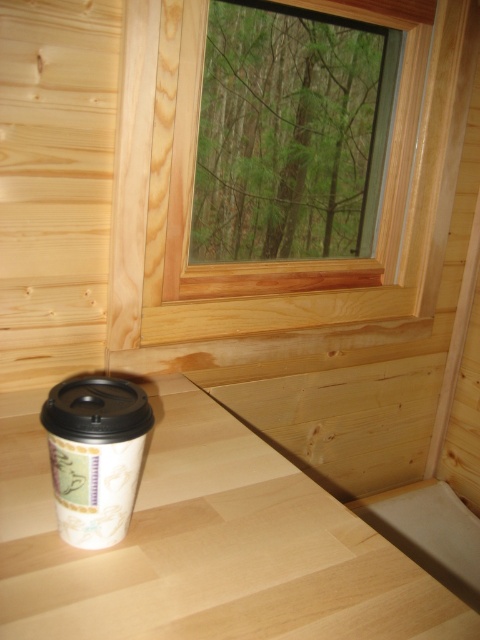
Does point (109, 563) come closer to viewer compared to point (352, 305)?

Yes.

Locate an element on the screen. This screenshot has width=480, height=640. white wood table at lower center is located at coordinates (204, 544).

Find the location of a particular element. white wood table at lower center is located at coordinates (204, 544).

Is natural wood window at upper center closer to the viewer compared to white paper cup at lower left?

That is False.

Consider the image. Who is shorter, natural wood window at upper center or white paper cup at lower left?

Standing shorter between the two is white paper cup at lower left.

What do you see at coordinates (285, 260) in the screenshot?
I see `natural wood window at upper center` at bounding box center [285, 260].

Image resolution: width=480 pixels, height=640 pixels. Identify the location of natural wood window at upper center. (285, 260).

Can you confirm if white wood table at lower center is positioned to the left of white paper cup at lower left?

In fact, white wood table at lower center is to the right of white paper cup at lower left.

Does white wood table at lower center appear over white paper cup at lower left?

Incorrect, white wood table at lower center is not positioned above white paper cup at lower left.

The width and height of the screenshot is (480, 640). Identify the location of white wood table at lower center. (204, 544).

Where is `white wood table at lower center`? white wood table at lower center is located at coordinates (204, 544).